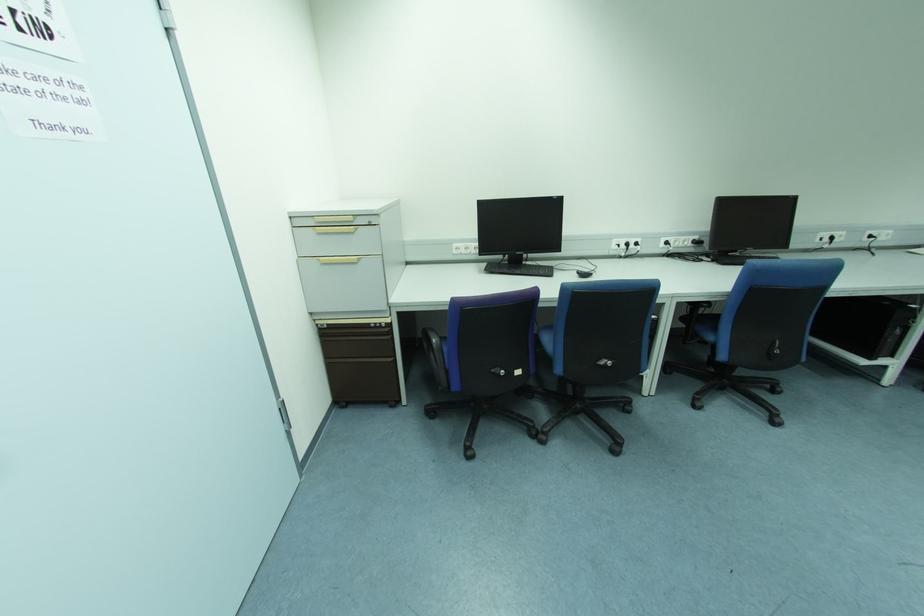
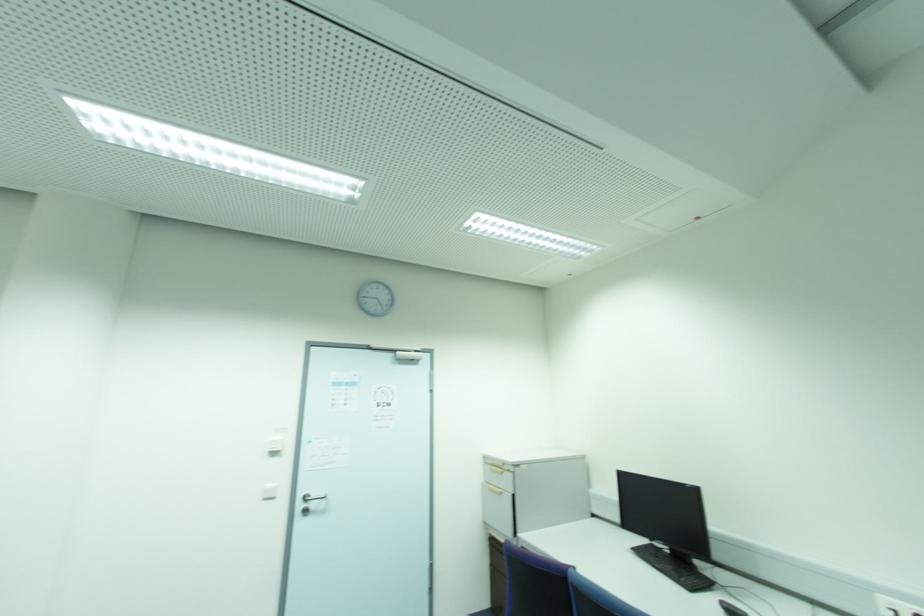
Where in the second image is the point corresponding to the point at 359,261 from the first image?

(502, 493)